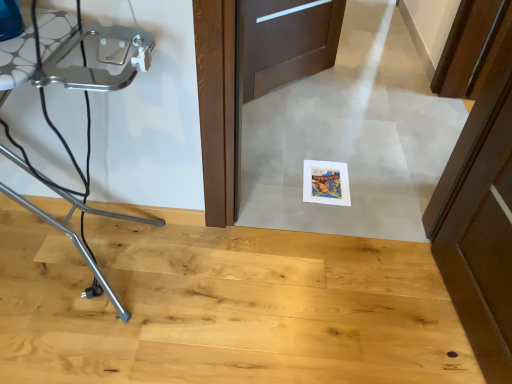
Where is `vacant area situated below metallic silver tripod at left (from a real-world perspective)`? The image size is (512, 384). vacant area situated below metallic silver tripod at left (from a real-world perspective) is located at coordinates (80, 261).